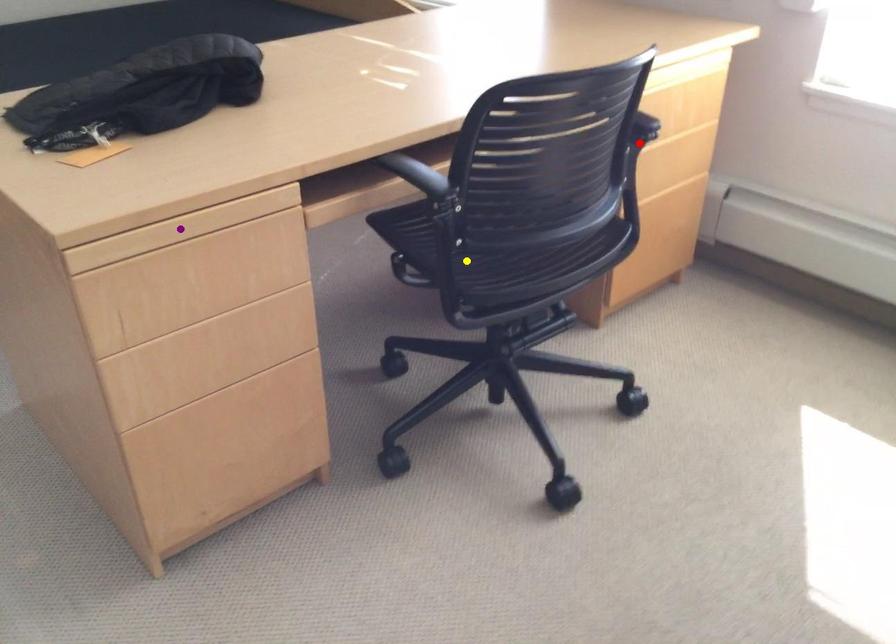
Order these from nearest to farthest:
purple point | red point | yellow point

red point < yellow point < purple point